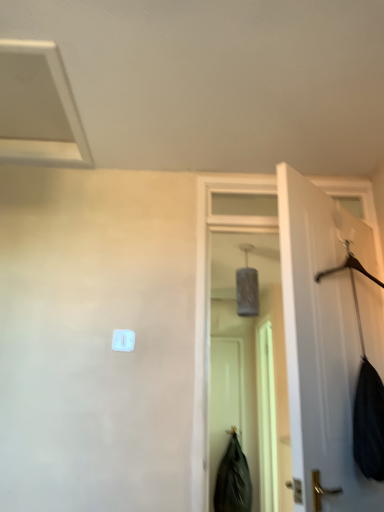
In order to face white plastic light switch at center, should I rotate leftwards or rightwards?

You should look left and rotate roughly 9.328 degrees.

The height and width of the screenshot is (512, 384). Describe the element at coordinates (123, 340) in the screenshot. I see `white plastic light switch at center` at that location.

Where is `white plastic exhaust hood at upper left`? white plastic exhaust hood at upper left is located at coordinates (38, 108).

This screenshot has height=512, width=384. In order to click on black matte screen door at center, the first screen door when ordered from left to right in this screenshot , I will do `click(223, 399)`.

Considering the sizes of white plastic exhaust hood at upper left and white matte door at right in the image, is white plastic exhaust hood at upper left taller or shorter than white matte door at right?

Considering their sizes, white plastic exhaust hood at upper left has less height than white matte door at right.

Is white plastic exhaust hood at upper left facing towards white matte door at right?

No, white plastic exhaust hood at upper left is not facing towards white matte door at right.

Based on the photo, can we say white plastic exhaust hood at upper left lies outside white matte door at right?

That's correct, white plastic exhaust hood at upper left is outside of white matte door at right.

Where is `door below the white plastic exhaust hood at upper left (from a real-world perspective)`? door below the white plastic exhaust hood at upper left (from a real-world perspective) is located at coordinates (322, 342).

Is black matte coat at lower center inside or outside of translucent plastic screen door at center, which is the 1th screen door in right-to-left order?

black matte coat at lower center is not inside translucent plastic screen door at center, which is the 1th screen door in right-to-left order, it's outside.

Is black matte coat at lower center placed right next to translucent plastic screen door at center, positioned as the second screen door in left-to-right order?

No, black matte coat at lower center is not beside translucent plastic screen door at center, positioned as the second screen door in left-to-right order.

From the image's perspective, between black matte coat at lower center and translucent plastic screen door at center, positioned as the second screen door in left-to-right order, which one is located above?

translucent plastic screen door at center, positioned as the second screen door in left-to-right order, is shown above in the image.

Is black matte coat at lower center in front of or behind translucent plastic screen door at center, positioned as the second screen door in left-to-right order, in the image?

In the image, black matte coat at lower center appears behind translucent plastic screen door at center, positioned as the second screen door in left-to-right order.

Is black matte screen door at center, the second screen door from the right, oriented away from black matte coat at lower center?

Yes.

Based on the photo, from the image's perspective, relative to black matte coat at lower center, is black matte screen door at center, the second screen door from the right, above or below?

black matte screen door at center, the second screen door from the right, is above black matte coat at lower center.

From the image's perspective, count 1st screen doors upward from the black matte coat at lower center and point to it. Please provide its 2D coordinates.

[(223, 399)]

Between black matte screen door at center, the second screen door from the right, and black matte coat at lower center, which one has smaller size?

With smaller size is black matte screen door at center, the second screen door from the right.

Considering the relative sizes of black matte screen door at center, the second screen door from the right, and white plastic light switch at center in the image provided, is black matte screen door at center, the second screen door from the right, bigger than white plastic light switch at center?

Indeed, black matte screen door at center, the second screen door from the right, has a larger size compared to white plastic light switch at center.

Is black matte screen door at center, the second screen door from the right, facing away from white plastic light switch at center?

No, black matte screen door at center, the second screen door from the right,'s orientation is not away from white plastic light switch at center.

Is black matte screen door at center, the first screen door when ordered from left to right, behind white plastic light switch at center?

That is True.

Is black matte screen door at center, the first screen door when ordered from left to right, with white plastic light switch at center?

No, black matte screen door at center, the first screen door when ordered from left to right, is not next to white plastic light switch at center.

Which point is more distant from viewer, (x=215, y=358) or (x=40, y=150)?

Point (x=215, y=358)

Could you tell me if black matte screen door at center, the first screen door when ordered from left to right, is turned towards white plastic exhaust hood at upper left?

No, black matte screen door at center, the first screen door when ordered from left to right, does not turn towards white plastic exhaust hood at upper left.

Does black matte screen door at center, the first screen door when ordered from left to right, have a lesser width compared to white plastic exhaust hood at upper left?

Correct, the width of black matte screen door at center, the first screen door when ordered from left to right, is less than that of white plastic exhaust hood at upper left.

Is black matte screen door at center, the second screen door from the right, far from white plastic exhaust hood at upper left?

black matte screen door at center, the second screen door from the right, is far away from white plastic exhaust hood at upper left.

Is black matte coat at lower center oriented away from white plastic light switch at center?

No, white plastic light switch at center is not at the back of black matte coat at lower center.

Is black matte coat at lower center next to white plastic light switch at center?

black matte coat at lower center is not next to white plastic light switch at center, and they're not touching.

From the image's perspective, is black matte coat at lower center positioned above or below white plastic light switch at center?

From the image's perspective, black matte coat at lower center appears below white plastic light switch at center.

Based on the photo, is black matte coat at lower center smaller than white plastic light switch at center?

No.

Measure the distance from black matte coat at lower center to white plastic exhaust hood at upper left.

black matte coat at lower center is 3.32 meters away from white plastic exhaust hood at upper left.

Based on the photo, from the image's perspective, is black matte coat at lower center on top of white plastic exhaust hood at upper left?

Actually, black matte coat at lower center appears below white plastic exhaust hood at upper left in the image.

Consider the image. From a real-world perspective, does black matte coat at lower center stand above white plastic exhaust hood at upper left?

No, from a real-world perspective, black matte coat at lower center is not over white plastic exhaust hood at upper left

Is white plastic exhaust hood at upper left located within black matte coat at lower center?

No, white plastic exhaust hood at upper left is not inside black matte coat at lower center.

Find the location of a particular element. exhaust hood above the white matte door at right (from the image's perspective) is located at coordinates (38, 108).

Identify the location of clothing that is on the left side of translucent plastic screen door at center, positioned as the second screen door in left-to-right order. (233, 479).

Based on their spatial positions, is black matte coat at lower center or white matte door at right further from black matte screen door at center, the second screen door from the right?

The object further to black matte screen door at center, the second screen door from the right, is white matte door at right.

Based on their spatial positions, is black matte coat at lower center or white plastic light switch at center further from white plastic exhaust hood at upper left?

black matte coat at lower center is positioned further to the anchor white plastic exhaust hood at upper left.

From the image, which object appears to be nearer to white plastic light switch at center, black matte coat at lower center or white matte door at right?

white matte door at right is positioned closer to the anchor white plastic light switch at center.

From the image, which object appears to be nearer to black matte coat at lower center, white plastic exhaust hood at upper left or white matte door at right?

white matte door at right lies closer to black matte coat at lower center than the other object.

Considering their positions, is translucent plastic screen door at center, positioned as the second screen door in left-to-right order, positioned further to black matte screen door at center, the second screen door from the right, than white plastic light switch at center?

Based on the image, white plastic light switch at center appears to be further to black matte screen door at center, the second screen door from the right.

When comparing their distances from white plastic light switch at center, does black matte screen door at center, the second screen door from the right, or white plastic exhaust hood at upper left seem closer?

white plastic exhaust hood at upper left.

Estimate the real-world distances between objects in this image. Which object is closer to white plastic exhaust hood at upper left, white plastic light switch at center or translucent plastic screen door at center, positioned as the second screen door in left-to-right order?

The object closer to white plastic exhaust hood at upper left is white plastic light switch at center.

Looking at the image, which one is located further to white plastic exhaust hood at upper left, translucent plastic screen door at center, which is the 1th screen door in right-to-left order, or black matte coat at lower center?

black matte coat at lower center lies further to white plastic exhaust hood at upper left than the other object.

Locate an element on the screen. Image resolution: width=384 pixels, height=512 pixels. exhaust hood positioned between white matte door at right and black matte coat at lower center from near to far is located at coordinates (38, 108).

In order to click on clothing positioned between white plastic light switch at center and black matte screen door at center, the first screen door when ordered from left to right, from near to far in this screenshot , I will do `click(233, 479)`.

At what (x,y) coordinates should I click in order to perform the action: click on screen door located between white matte door at right and black matte screen door at center, the first screen door when ordered from left to right, in the depth direction. Please return your answer as a coordinate pair (x, y). Looking at the image, I should click on (266, 418).

Find the location of a particular element. This screenshot has height=512, width=384. screen door between white matte door at right and black matte coat at lower center in the front-back direction is located at coordinates (266, 418).